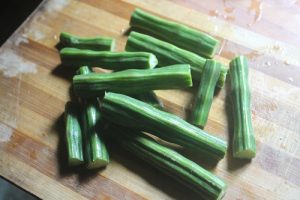
The width and height of the screenshot is (300, 200). I want to click on reflected white light on cutting board, so click(x=298, y=17), click(x=292, y=41).